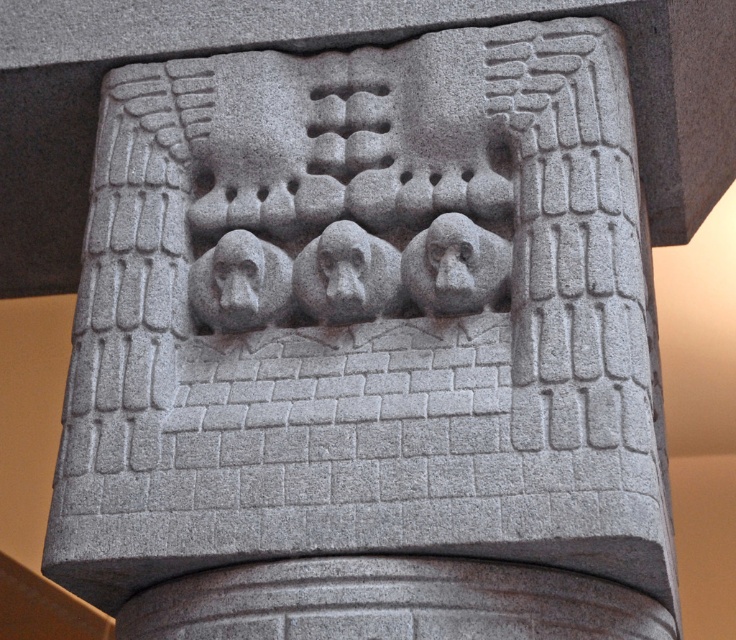
You are an architect examining the relief carving on the column. You notice two central monkey figures labeled as granite monkey at center and gray stone monkey at center. Which one, if either, is wider?

The granite monkey at center is wider than the gray stone monkey at center according to the description provided.